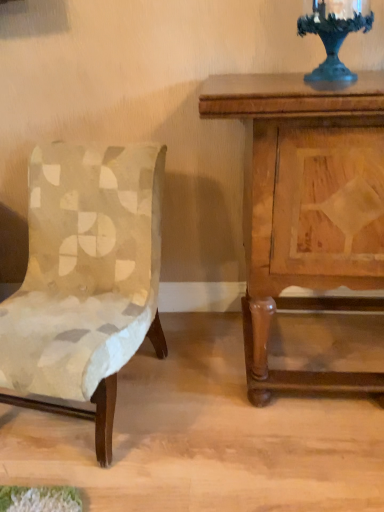
Question: Is velvet beige chair at left facing towards wooden nightstand at right?

Choices:
 (A) no
 (B) yes

Answer: (A)

Question: Is the position of velvet beige chair at left more distant than that of wooden nightstand at right?

Choices:
 (A) yes
 (B) no

Answer: (B)

Question: From a real-world perspective, is velvet beige chair at left over wooden nightstand at right?

Choices:
 (A) no
 (B) yes

Answer: (A)

Question: Does velvet beige chair at left come in front of wooden nightstand at right?

Choices:
 (A) yes
 (B) no

Answer: (A)

Question: Is velvet beige chair at left positioned far away from wooden nightstand at right?

Choices:
 (A) yes
 (B) no

Answer: (B)

Question: Is wooden nightstand at right spatially inside velvet beige chair at left, or outside of it?

Choices:
 (A) outside
 (B) inside

Answer: (A)

Question: From the image's perspective, relative to velvet beige chair at left, is wooden nightstand at right above or below?

Choices:
 (A) below
 (B) above

Answer: (B)

Question: Is wooden nightstand at right in front of or behind velvet beige chair at left in the image?

Choices:
 (A) front
 (B) behind

Answer: (B)

Question: Based on their sizes in the image, would you say wooden nightstand at right is bigger or smaller than velvet beige chair at left?

Choices:
 (A) small
 (B) big

Answer: (B)

Question: Is velvet beige chair at left situated inside wooden nightstand at right or outside?

Choices:
 (A) inside
 (B) outside

Answer: (B)

Question: Does point (86, 308) appear closer or farther from the camera than point (254, 187)?

Choices:
 (A) closer
 (B) farther

Answer: (B)

Question: From a real-world perspective, relative to wooden nightstand at right, is velvet beige chair at left vertically above or below?

Choices:
 (A) below
 (B) above

Answer: (A)

Question: In terms of height, does velvet beige chair at left look taller or shorter compared to wooden nightstand at right?

Choices:
 (A) short
 (B) tall

Answer: (A)

Question: Considering the positions of wooden nightstand at right and metallic dark blue candle holder at upper right in the image, is wooden nightstand at right wider or thinner than metallic dark blue candle holder at upper right?

Choices:
 (A) thin
 (B) wide

Answer: (B)

Question: Based on their positions, is wooden nightstand at right located to the left or right of metallic dark blue candle holder at upper right?

Choices:
 (A) right
 (B) left

Answer: (A)